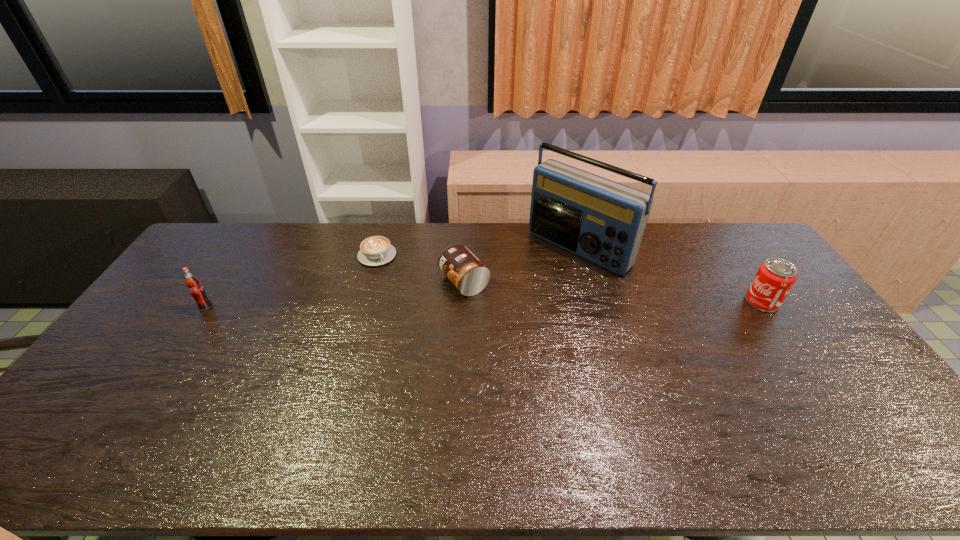
This screenshot has height=540, width=960. I want to click on free spot on the desktop that is between the leftmost object and the taller can and is positioned on the front panel of the fourth object from left to right, so [516, 304].

I want to click on free space on the desktop that is between the leftmost object and the right can and is positioned on the side of the shortest object with the handle, so click(411, 305).

In order to click on vacant space on the desktop that is between the soda bottle and the rightmost object and is positioned on the front label of the left can in this screenshot , I will do `click(410, 305)`.